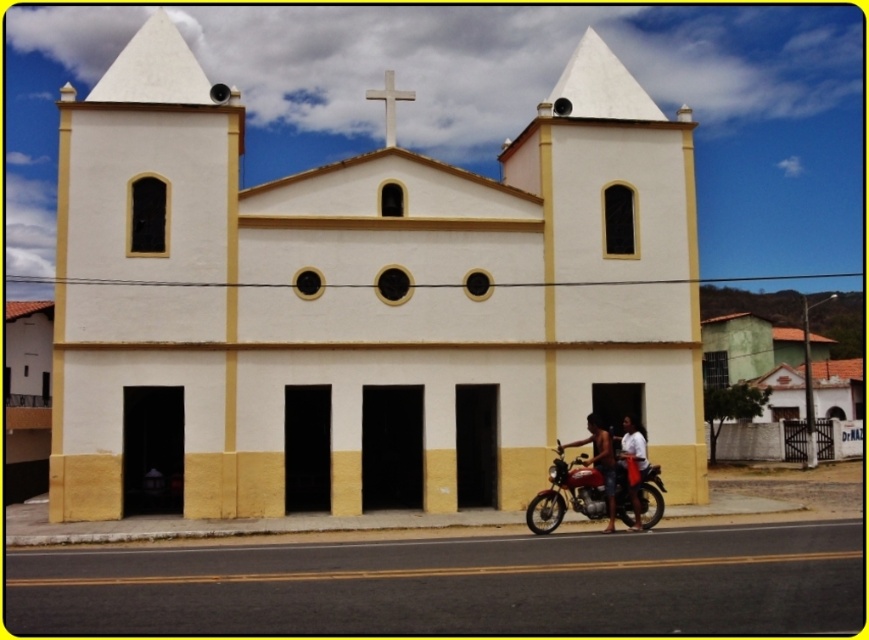
Question: Which object is the closest to the tan shorts at lower center?

Choices:
 (A) metallic red motorcycle at lower right
 (B) white smooth cross at upper center
 (C) white cotton shirt at center
 (D) white matte church at center

Answer: (C)

Question: Which object is farther from the camera taking this photo?

Choices:
 (A) white matte church at center
 (B) metallic red motorcycle at lower right
 (C) white cotton shirt at center
 (D) tan shorts at lower center

Answer: (A)

Question: Is white cotton shirt at center above white smooth cross at upper center?

Choices:
 (A) no
 (B) yes

Answer: (A)

Question: Which of the following is the closest to the observer?

Choices:
 (A) (389, 128)
 (B) (87, 492)

Answer: (B)

Question: Can you confirm if metallic red motorcycle at lower right is wider than white smooth cross at upper center?

Choices:
 (A) no
 (B) yes

Answer: (A)

Question: Is metallic red motorcycle at lower right above white cotton shirt at center?

Choices:
 (A) yes
 (B) no

Answer: (B)